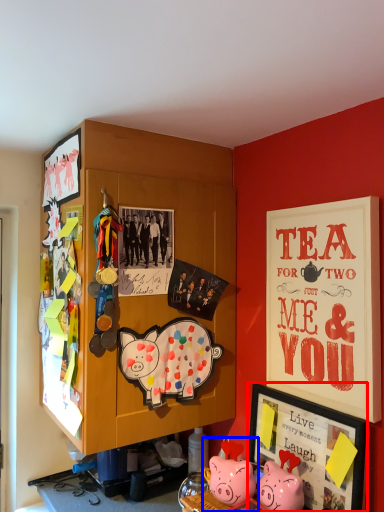
Question: Which object is further to the camera taking this photo, picture frame (highlighted by a red box) or toy (highlighted by a blue box)?

Choices:
 (A) picture frame
 (B) toy

Answer: (B)